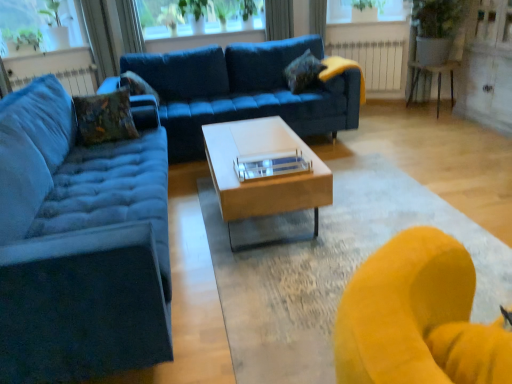
Question: From their relative heights in the image, would you say white metallic radiator at center, which ranks as the second radiator in left-to-right order, is taller or shorter than velvet textured pillow at upper left, the second pillow when ordered from left to right?

Choices:
 (A) short
 (B) tall

Answer: (B)

Question: In the image, is white metallic radiator at center, which ranks as the second radiator in left-to-right order, positioned in front of or behind velvet textured pillow at upper left, which is the second pillow from front to back?

Choices:
 (A) front
 (B) behind

Answer: (B)

Question: Which object is the closest to the green leafy plant at upper left?

Choices:
 (A) velvet textured pillow at upper center, the 1th pillow from the right
 (B) blue fabric curtain at upper center
 (C) velvet textured pillow at upper left, the second pillow when ordered from left to right
 (D) white glossy coffee table at center
 (E) textured velvet pillow at left, which is the 1th pillow in left-to-right order

Answer: (C)

Question: Which object is the farthest from the white glossy coffee table at center?

Choices:
 (A) textured velvet pillow at left, arranged as the third pillow when viewed from the right
 (B) metallic silver swivel chair at right
 (C) velvet textured pillow at upper center, the third pillow in the front-to-back sequence
 (D) white metallic radiator at center, which is the first radiator in right-to-left order
 (E) clear glass window screen at upper center, which ranks as the 1th window screen in right-to-left order

Answer: (E)